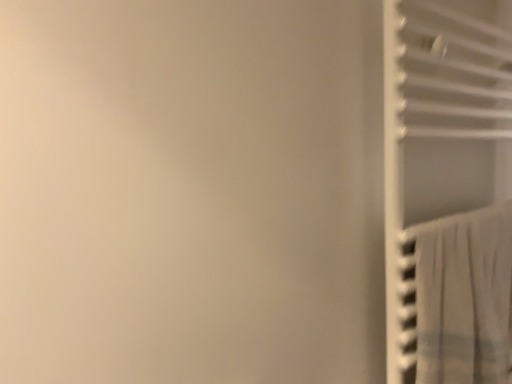
Question: From the image's perspective, is white plastic closet at right located above or below white sheer curtain at right?

Choices:
 (A) below
 (B) above

Answer: (B)

Question: Relative to white sheer curtain at right, is white plastic closet at right in front or behind?

Choices:
 (A) front
 (B) behind

Answer: (A)

Question: Looking at the image, does white plastic closet at right seem bigger or smaller compared to white sheer curtain at right?

Choices:
 (A) small
 (B) big

Answer: (B)

Question: Is white sheer curtain at right inside or outside of white plastic closet at right?

Choices:
 (A) inside
 (B) outside

Answer: (A)

Question: Is white sheer curtain at right bigger or smaller than white plastic closet at right?

Choices:
 (A) big
 (B) small

Answer: (B)

Question: From the image's perspective, relative to white plastic closet at right, is white sheer curtain at right above or below?

Choices:
 (A) above
 (B) below

Answer: (B)

Question: In the image, is white sheer curtain at right positioned in front of or behind white plastic closet at right?

Choices:
 (A) front
 (B) behind

Answer: (B)